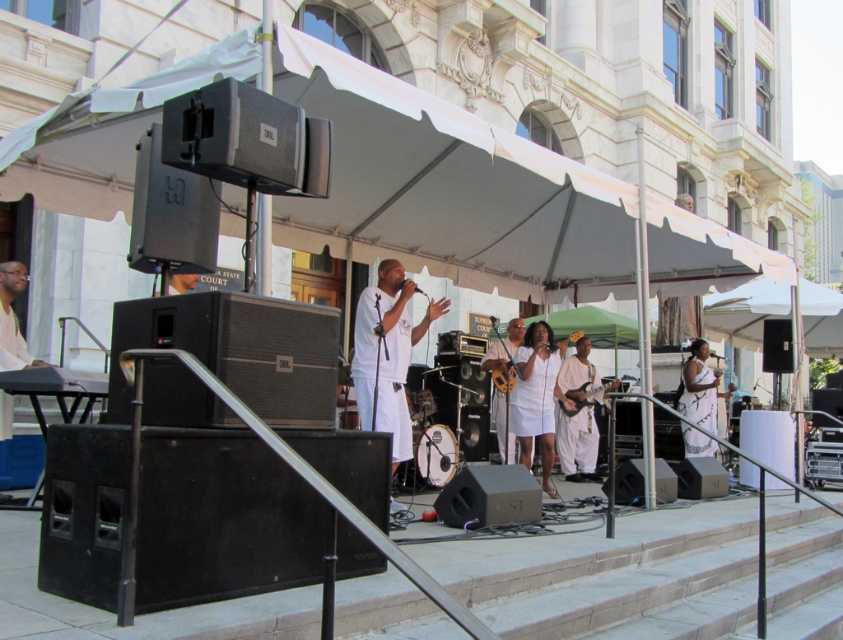
Does point (376, 378) come in front of point (487, 369)?

Yes, point (376, 378) is in front of point (487, 369).

Is white matte t-shirt at center smaller than white fabric guitar at center?

No.

Locate an element on the screen. The image size is (843, 640). white matte t-shirt at center is located at coordinates (387, 353).

The height and width of the screenshot is (640, 843). Find the location of `white matte t-shirt at center`. white matte t-shirt at center is located at coordinates (387, 353).

Which is in front, point (441, 300) or point (604, 385)?

Point (604, 385)

Is point (389, 396) closer to camera compared to point (610, 381)?

Yes, point (389, 396) is closer to viewer.

At what (x,y) coordinates should I click in order to perform the action: click on white matte t-shirt at center. Please return your answer as a coordinate pair (x, y). Looking at the image, I should click on (387, 353).

Is point (513, 348) behind point (593, 397)?

No.

Which is in front, point (495, 424) or point (578, 410)?

Point (578, 410)

Locate an element on the screen. This screenshot has width=843, height=640. white fabric guitar at center is located at coordinates (503, 348).